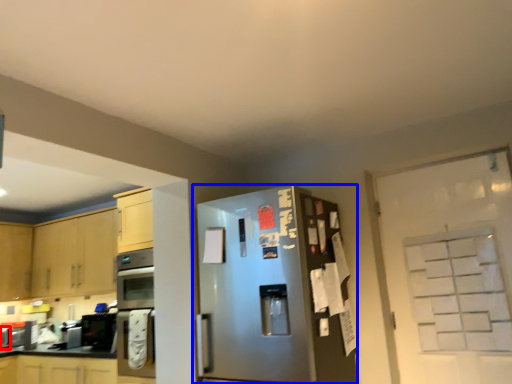
Question: Which object appears closest to the camera in this image, appliance (highlighted by a red box) or refrigerator (highlighted by a blue box)?

Choices:
 (A) appliance
 (B) refrigerator

Answer: (B)